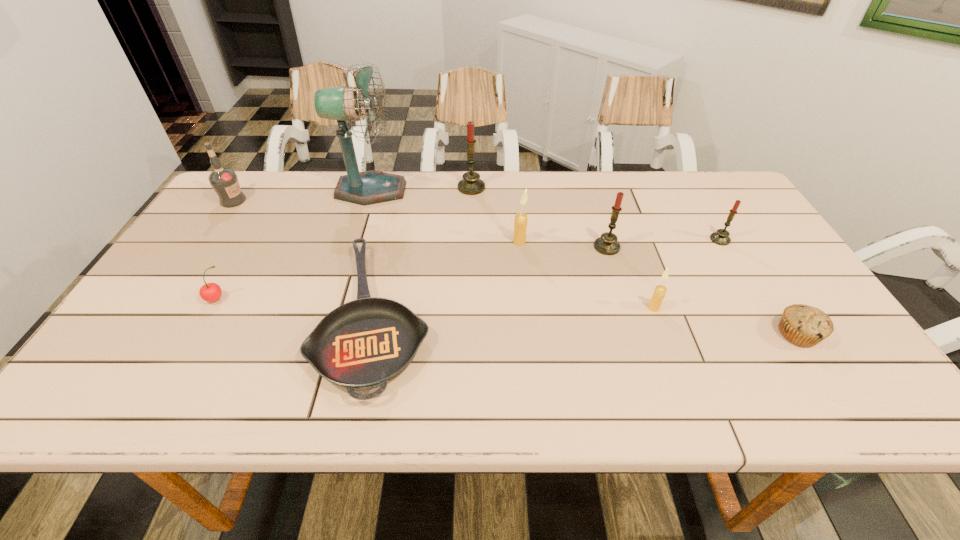
The width and height of the screenshot is (960, 540). In order to click on the rightmost red candle in this screenshot , I will do `click(721, 237)`.

Image resolution: width=960 pixels, height=540 pixels. I want to click on the smaller cream candle, so click(x=659, y=293).

You are a GUI agent. You are given a task and a screenshot of the screen. Output one action in this format:
    pyautogui.click(x=<x>, y=<y>)
    Task: Click on the right cream candle
    The width and height of the screenshot is (960, 540).
    Given the screenshot: What is the action you would take?
    pyautogui.click(x=659, y=293)

This screenshot has height=540, width=960. In order to click on cherry in this screenshot , I will do `click(210, 292)`.

I want to click on red cherry, so click(210, 292).

Where is `the ninth tallest object`? The height and width of the screenshot is (540, 960). the ninth tallest object is located at coordinates (806, 326).

You are a GUI agent. You are given a task and a screenshot of the screen. Output one action in this format:
    pyautogui.click(x=<x>, y=<y>)
    Task: Click on the shortest object
    The width and height of the screenshot is (960, 540).
    Given the screenshot: What is the action you would take?
    pyautogui.click(x=363, y=344)

Where is `frying pan`? frying pan is located at coordinates (363, 344).

At what (x,y) coordinates should I click in order to perform the action: click on vacant space located in front of the tallest object where the wind blows. Please return your answer as a coordinate pair (x, y). The height and width of the screenshot is (540, 960). Looking at the image, I should click on 505,191.

Image resolution: width=960 pixels, height=540 pixels. In order to click on vacant point located 0.160m on the front of the leftmost red candle in this screenshot , I will do `click(470, 227)`.